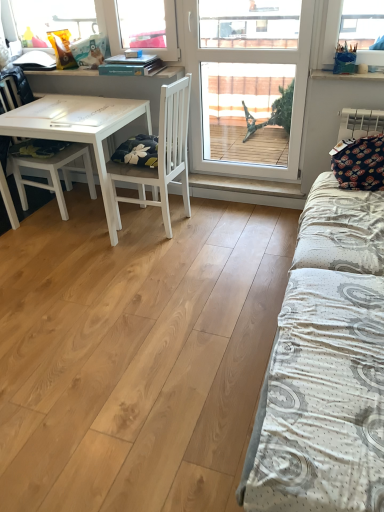
The width and height of the screenshot is (384, 512). I want to click on free point above white plastic bag at upper right (from a real-world perspective), so click(353, 72).